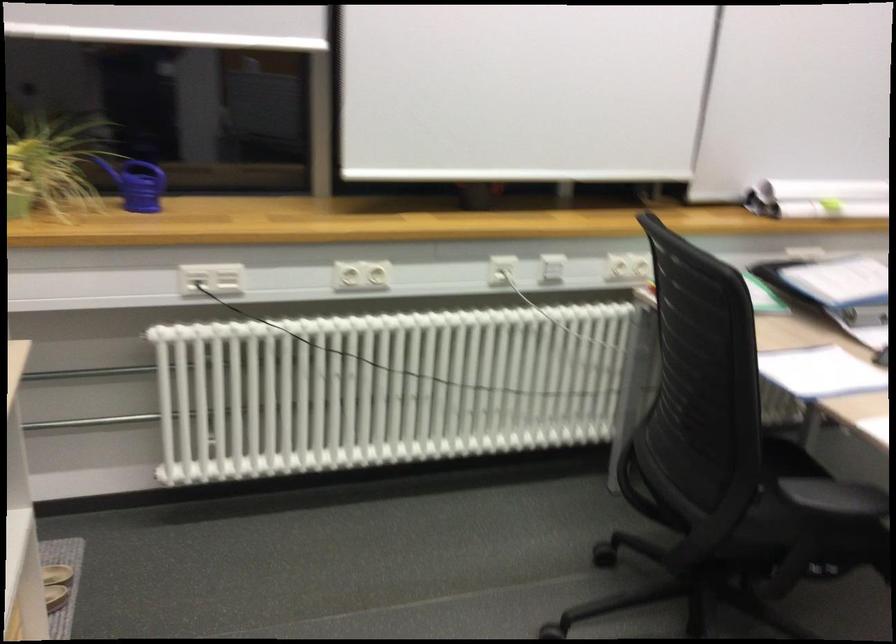
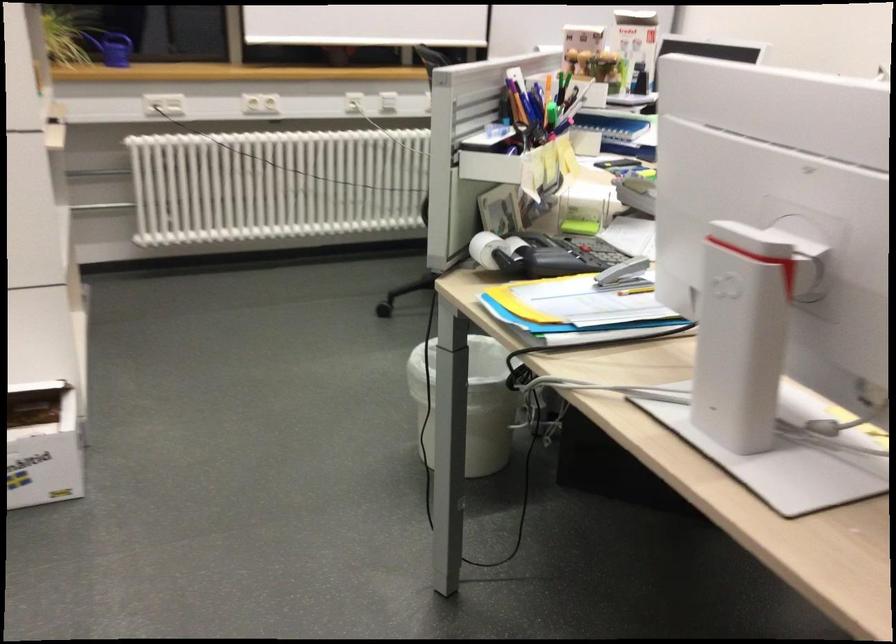
Where in the second image is the point corresponding to pixel 135 193 from the first image?

(112, 48)